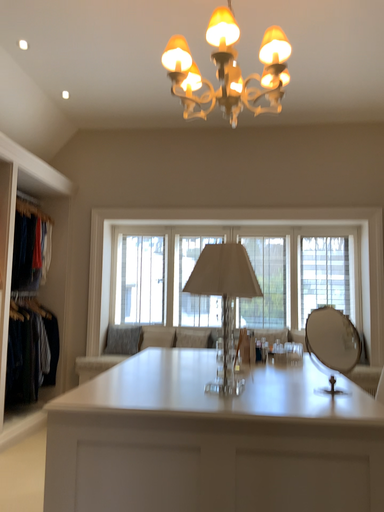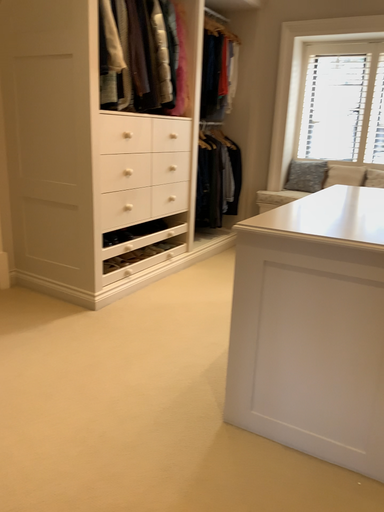
Question: How did the camera likely rotate when shooting the video?

Choices:
 (A) rotated downward
 (B) rotated upward

Answer: (A)